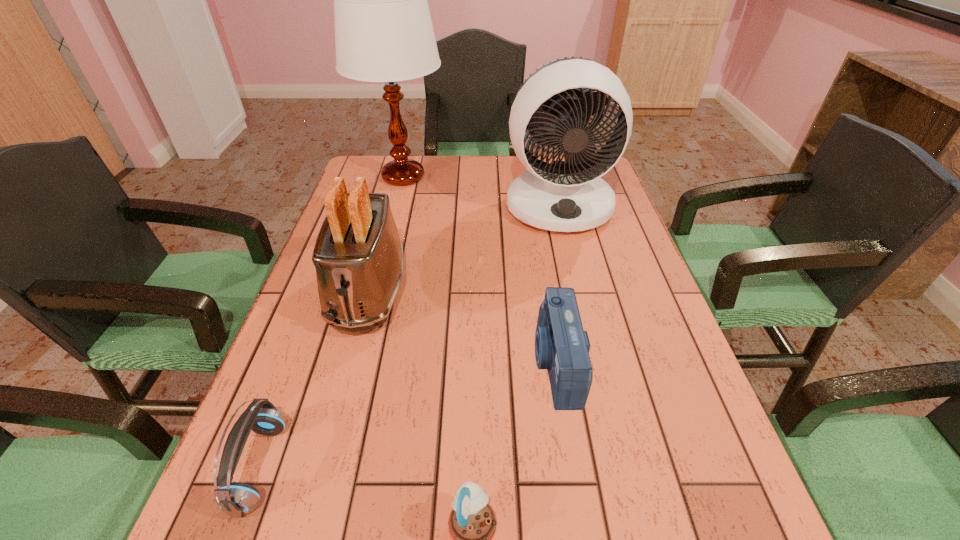
The image size is (960, 540). Find the location of `object that is the fourth closest to the headset`. object that is the fourth closest to the headset is located at coordinates (566, 196).

The height and width of the screenshot is (540, 960). Identify the location of the fifth closest object to the third object from right to left. (383, 29).

This screenshot has height=540, width=960. I want to click on free space that satisfies the following two spatial constraints: 1. on the grille of the fan; 2. on the ear cups of the headset, so click(622, 467).